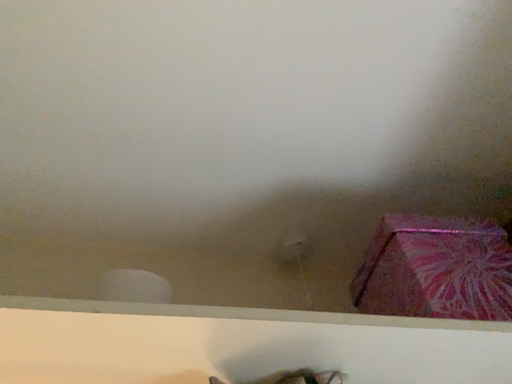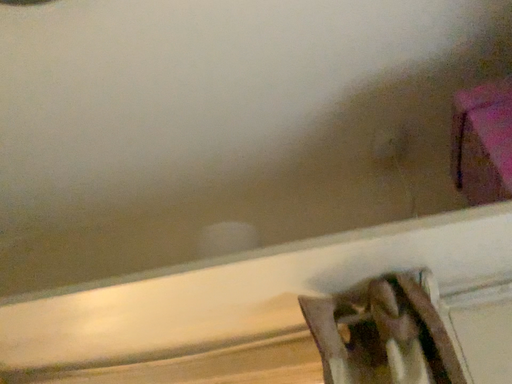
Question: Which way did the camera rotate in the video?

Choices:
 (A) rotated downward
 (B) rotated upward

Answer: (A)